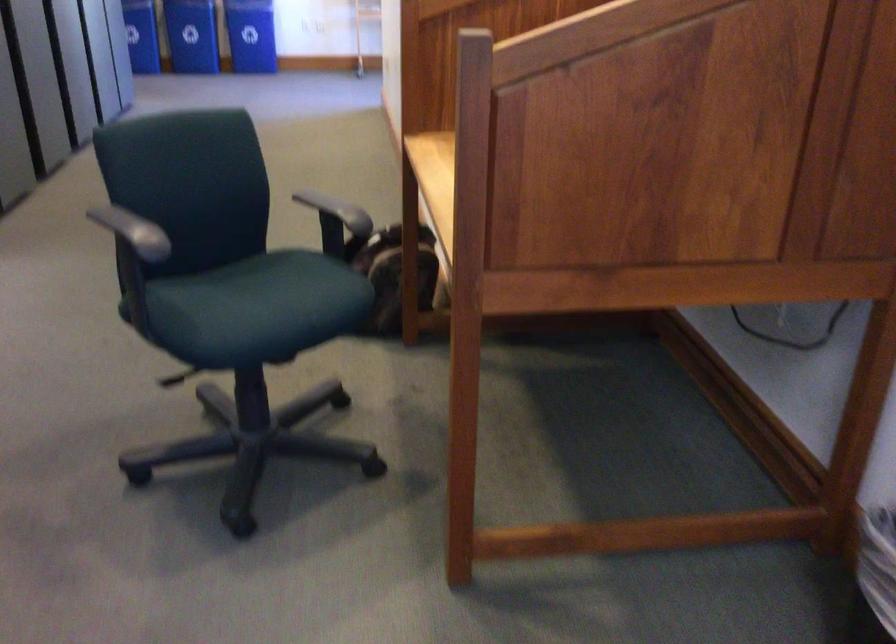
Where is `green chair sitting surface`? green chair sitting surface is located at coordinates (277, 295).